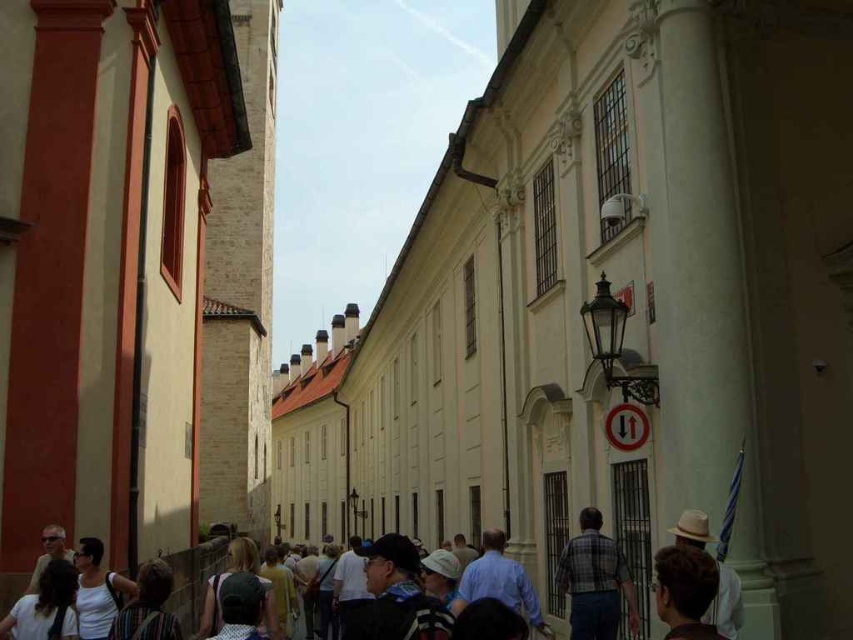
Is dark brown leather backpack at lower left wider than matte black sunglasses at lower left?

Incorrect, dark brown leather backpack at lower left's width does not surpass matte black sunglasses at lower left's.

Is point (158, 621) farther from camera compared to point (41, 556)?

No, (158, 621) is in front of (41, 556).

Is point (117, 628) closer to camera compared to point (38, 570)?

Yes, point (117, 628) is closer to viewer.

Identify the location of dark brown leather backpack at lower left. This screenshot has height=640, width=853. (148, 605).

Is light blue shirt at center above dark brown leather backpack at lower left?

No, light blue shirt at center is not above dark brown leather backpack at lower left.

Between light blue shirt at center and dark brown leather backpack at lower left, which one has less height?

Standing shorter between the two is dark brown leather backpack at lower left.

Does point (495, 570) come closer to viewer compared to point (143, 621)?

No, it is not.

Find the location of a particular element. light blue shirt at center is located at coordinates (498, 582).

Which is below, plaid shirt at center or white cotton tank top at lower left?

plaid shirt at center is below.

Is plaid shirt at center bigger than white cotton tank top at lower left?

Actually, plaid shirt at center might be smaller than white cotton tank top at lower left.

Where is `plaid shirt at center`? Image resolution: width=853 pixels, height=640 pixels. plaid shirt at center is located at coordinates (595, 580).